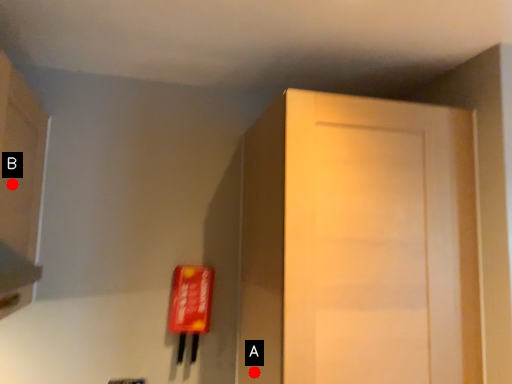
Question: Two points are circled on the image, labeled by A and B beside each circle. Among these points, which one is farthest from the camera?

Choices:
 (A) A is further
 (B) B is further

Answer: (A)